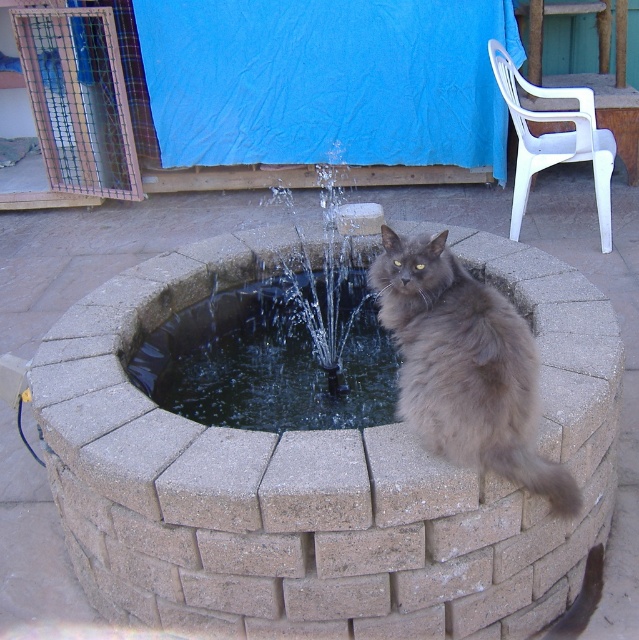
You are a visitor at this location and want to know if the clear water at fountain center can accommodate the gray fluffy cat at upper center in terms of width. Based on the scene, what can you conclude?

The clear water at fountain center has a larger width than the gray fluffy cat at upper center, so the cat can fit within the water area in terms of width.

You are standing in the garden and want to approach the brown brick fountain at center. If you are 1.5 meters tall, will you be able to see over the fountain from your current position?

The brown brick fountain at center is 4.16 meters away from the viewer. Since the fountain is a circular structure with a water feature in its center, and the viewer is 1.5 meters tall, it is possible that the fountain may block the view depending on its height. However, without knowing the fountain height, we cannot definitively determine visibility.